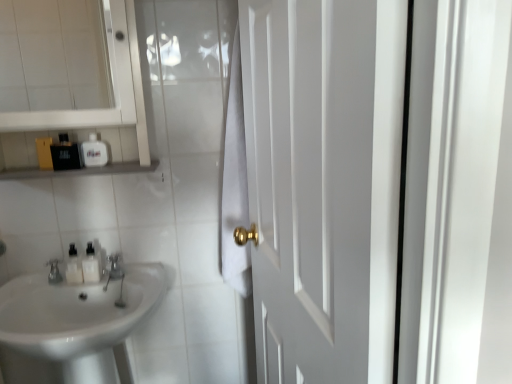
Image resolution: width=512 pixels, height=384 pixels. Identify the location of free space to the left of white glossy soap dispenser at left, the 2th toiletry in the bottom-to-top sequence. (30, 278).